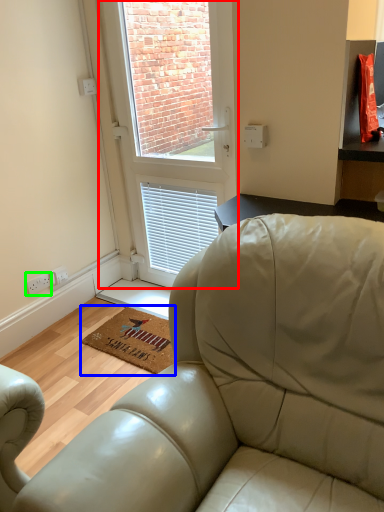
Question: Considering the real-world distances, which object is farthest from window (highlighted by a red box)? mat (highlighted by a blue box) or electric outlet (highlighted by a green box)?

Choices:
 (A) mat
 (B) electric outlet

Answer: (B)